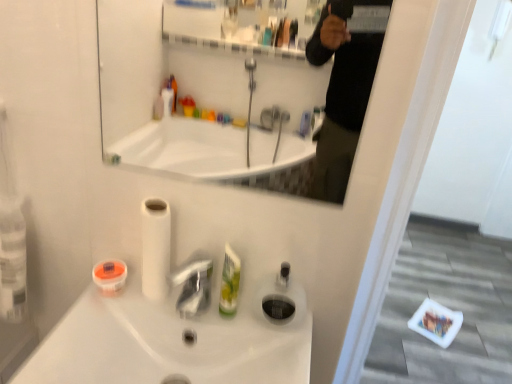
Identify the location of vacant area to the left of white matte toilet paper at center. (100, 312).